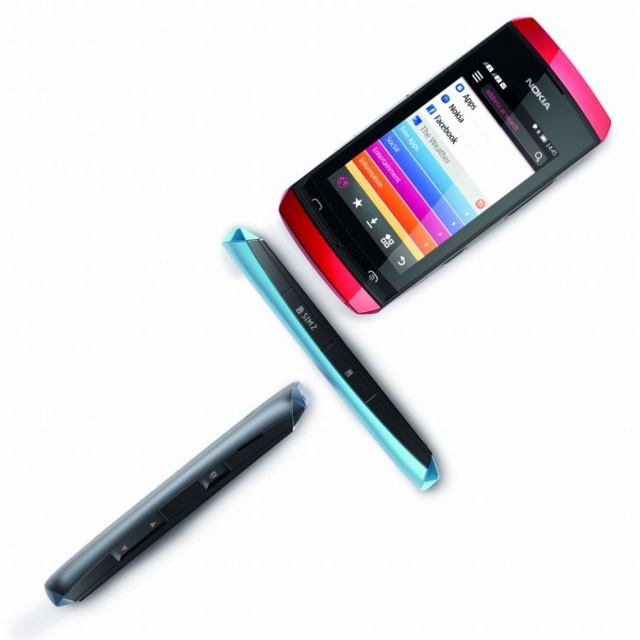
Does point (358, 253) come farther from viewer compared to point (160, 529)?

Yes, it is behind point (160, 529).

Consider the image. Which is above, pink glossy smartphone at upper center or black glossy pen at center?

pink glossy smartphone at upper center is higher up.

The height and width of the screenshot is (640, 640). Identify the location of pink glossy smartphone at upper center. (444, 164).

The image size is (640, 640). In order to click on pink glossy smartphone at upper center in this screenshot , I will do `click(444, 164)`.

Is point (125, 554) farther from camera compared to point (328, 330)?

No, it is not.

Looking at this image, who is more forward, (196, 497) or (428, 483)?

Point (196, 497)

At what (x,y) coordinates should I click in order to perform the action: click on black glossy pen at center. Please return your answer as a coordinate pair (x, y). The height and width of the screenshot is (640, 640). Looking at the image, I should click on (177, 497).

Can you confirm if pink glossy smartphone at upper center is positioned to the right of translucent plastic stylus at center?

Correct, you'll find pink glossy smartphone at upper center to the right of translucent plastic stylus at center.

Who is more forward, (451, 168) or (285, 269)?

Point (451, 168) is more forward.

I want to click on pink glossy smartphone at upper center, so click(x=444, y=164).